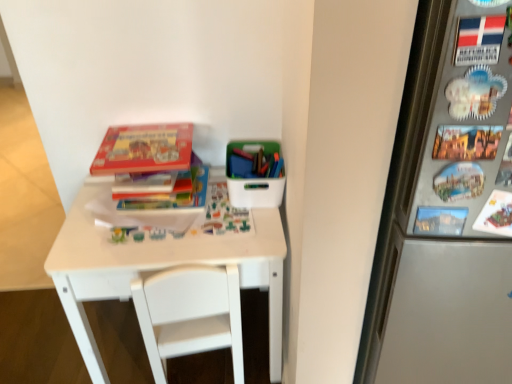
In order to face white plastic container at upper right, should I rotate leftwards or rightwards?

It's best to rotate right around 0.022 degrees.

Image resolution: width=512 pixels, height=384 pixels. What do you see at coordinates (144, 149) in the screenshot?
I see `matte cardboard book at upper left, acting as the second book starting from the bottom` at bounding box center [144, 149].

I want to click on matte cardboard book at upper left, the 1th book viewed from the top, so click(x=144, y=149).

What do you see at coordinates (189, 314) in the screenshot?
I see `white plastic chair at center` at bounding box center [189, 314].

The height and width of the screenshot is (384, 512). I want to click on hardcover book at center, which ranks as the first book in bottom-to-top order, so click(x=173, y=194).

The image size is (512, 384). I want to click on white plastic container at upper right, so click(x=255, y=173).

From the image's perspective, relative to white matte table at center, is white plastic container at upper right above or below?

Based on their image positions, white plastic container at upper right is located above white matte table at center.

In the image, there is a white matte table at center. At what (x,y) coordinates should I click in order to perform the action: click on box above it (from the image's perspective). Please return your answer as a coordinate pair (x, y). Looking at the image, I should click on (255, 173).

In terms of height, does white plastic container at upper right look taller or shorter compared to white matte table at center?

Clearly, white plastic container at upper right is shorter compared to white matte table at center.

Which of these two, white plastic container at upper right or white matte table at center, is thinner?

With smaller width is white plastic container at upper right.

In the image, is white plastic chair at center positioned in front of or behind white matte table at center?

Visually, white plastic chair at center is located in front of white matte table at center.

How many degrees apart are the facing directions of white plastic chair at center and white matte table at center?

173 degrees.

Find the location of `table above the white plastic chair at center (from the image's perspective)`. table above the white plastic chair at center (from the image's perspective) is located at coordinates (170, 269).

Can you see white plastic chair at center touching white matte table at center?

Yes, white plastic chair at center is in contact with white matte table at center.

Is white matte table at center to the right of matte cardboard book at upper left, the 1th book viewed from the top, from the viewer's perspective?

Yes.

Is point (269, 309) closer or farther from the camera than point (137, 159)?

Point (269, 309).

Can you confirm if white matte table at center is shorter than matte cardboard book at upper left, the 1th book viewed from the top?

No, white matte table at center is not shorter than matte cardboard book at upper left, the 1th book viewed from the top.

In terms of width, does hardcover book at center, the second book when ordered from top to bottom, look wider or thinner when compared to matte cardboard book at upper left, acting as the second book starting from the bottom?

Considering their sizes, hardcover book at center, the second book when ordered from top to bottom, looks slimmer than matte cardboard book at upper left, acting as the second book starting from the bottom.

Can you tell me how much hardcover book at center, the second book when ordered from top to bottom, and matte cardboard book at upper left, acting as the second book starting from the bottom, differ in facing direction?

The facing directions of hardcover book at center, the second book when ordered from top to bottom, and matte cardboard book at upper left, acting as the second book starting from the bottom, are 3.98 degrees apart.

Is hardcover book at center, the second book when ordered from top to bottom, oriented towards matte cardboard book at upper left, acting as the second book starting from the bottom?

No, hardcover book at center, the second book when ordered from top to bottom, is not turned towards matte cardboard book at upper left, acting as the second book starting from the bottom.

Is matte cardboard book at upper left, acting as the second book starting from the bottom, facing towards white plastic chair at center?

No, matte cardboard book at upper left, acting as the second book starting from the bottom, is not oriented towards white plastic chair at center.

In terms of width, does matte cardboard book at upper left, acting as the second book starting from the bottom, look wider or thinner when compared to white plastic chair at center?

Considering their sizes, matte cardboard book at upper left, acting as the second book starting from the bottom, looks slimmer than white plastic chair at center.

Image resolution: width=512 pixels, height=384 pixels. What are the coordinates of `chair below the matte cardboard book at upper left, acting as the second book starting from the bottom (from the image's perspective)` in the screenshot? It's located at (189, 314).

Would you say matte cardboard book at upper left, acting as the second book starting from the bottom, contains white plastic chair at center?

No, white plastic chair at center is not a part of matte cardboard book at upper left, acting as the second book starting from the bottom.

From the image's perspective, which is above, matte cardboard book at upper left, the 1th book viewed from the top, or white plastic container at upper right?

matte cardboard book at upper left, the 1th book viewed from the top, from the image's perspective.

Can you tell me how much matte cardboard book at upper left, acting as the second book starting from the bottom, and white plastic container at upper right differ in facing direction?

The facing directions of matte cardboard book at upper left, acting as the second book starting from the bottom, and white plastic container at upper right are 4.05 degrees apart.

From a real-world perspective, is matte cardboard book at upper left, the 1th book viewed from the top, physically located above or below white plastic container at upper right?

From a real-world perspective, matte cardboard book at upper left, the 1th book viewed from the top, is physically above white plastic container at upper right.

Is matte cardboard book at upper left, acting as the second book starting from the bottom, inside white plastic chair at center?

Definitely not — matte cardboard book at upper left, acting as the second book starting from the bottom, is not inside white plastic chair at center.

From the image's perspective, is white plastic chair at center positioned above or below matte cardboard book at upper left, acting as the second book starting from the bottom?

From the image's perspective, white plastic chair at center appears below matte cardboard book at upper left, acting as the second book starting from the bottom.

Looking at this image, is white plastic chair at center closer to the viewer compared to matte cardboard book at upper left, the 1th book viewed from the top?

Yes, it is.

Is white plastic chair at center facing away from matte cardboard book at upper left, the 1th book viewed from the top?

That's not correct — white plastic chair at center is not looking away from matte cardboard book at upper left, the 1th book viewed from the top.

You are a GUI agent. You are given a task and a screenshot of the screen. Output one action in this format:
    pyautogui.click(x=<x>, y=<y>)
    Task: Click on the box lying on the right of white matte table at center
    The image size is (512, 384).
    Given the screenshot: What is the action you would take?
    pyautogui.click(x=255, y=173)

Locate an element on the screen. chair below the white matte table at center (from a real-world perspective) is located at coordinates (189, 314).

Looking at the image, which one is located closer to white plastic chair at center, white matte table at center or white plastic container at upper right?

Among the two, white matte table at center is located nearer to white plastic chair at center.

In the scene shown: Based on their spatial positions, is white matte table at center or hardcover book at center, which ranks as the first book in bottom-to-top order, further from white plastic container at upper right?

Among the two, white matte table at center is located further to white plastic container at upper right.

From the image, which object appears to be nearer to hardcover book at center, the second book when ordered from top to bottom, white matte table at center or white plastic container at upper right?

white plastic container at upper right is positioned closer to the anchor hardcover book at center, the second book when ordered from top to bottom.

From the picture: When comparing their distances from white plastic chair at center, does hardcover book at center, the second book when ordered from top to bottom, or white plastic container at upper right seem further?

Among the two, white plastic container at upper right is located further to white plastic chair at center.

Which object lies nearer to the anchor point white plastic chair at center, matte cardboard book at upper left, acting as the second book starting from the bottom, or white matte table at center?

white matte table at center lies closer to white plastic chair at center than the other object.

From the picture: From the image, which object appears to be nearer to white plastic container at upper right, white matte table at center or matte cardboard book at upper left, the 1th book viewed from the top?

Based on the image, matte cardboard book at upper left, the 1th book viewed from the top, appears to be nearer to white plastic container at upper right.

Considering their positions, is white plastic container at upper right positioned further to matte cardboard book at upper left, the 1th book viewed from the top, than hardcover book at center, the second book when ordered from top to bottom?

white plastic container at upper right lies further to matte cardboard book at upper left, the 1th book viewed from the top, than the other object.

Which object lies nearer to the anchor point white plastic chair at center, matte cardboard book at upper left, the 1th book viewed from the top, or hardcover book at center, which ranks as the first book in bottom-to-top order?

Among the two, hardcover book at center, which ranks as the first book in bottom-to-top order, is located nearer to white plastic chair at center.

Identify the location of book between matte cardboard book at upper left, the 1th book viewed from the top, and white plastic container at upper right. This screenshot has width=512, height=384. point(173,194).

Locate an element on the screen. table between hardcover book at center, which ranks as the first book in bottom-to-top order, and white plastic chair at center vertically is located at coordinates (170, 269).

Where is `book between white plastic container at upper right and white matte table at center vertically`? The width and height of the screenshot is (512, 384). book between white plastic container at upper right and white matte table at center vertically is located at coordinates (173, 194).

Find the location of a particular element. The width and height of the screenshot is (512, 384). box between matte cardboard book at upper left, the 1th book viewed from the top, and white plastic chair at center vertically is located at coordinates (255, 173).